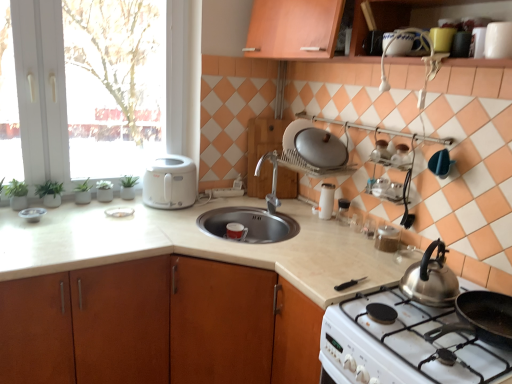
Identify the location of unoccupied space behind metallic silver bowl at left, the third appliance in the back-to-front sequence. The width and height of the screenshot is (512, 384). (52, 205).